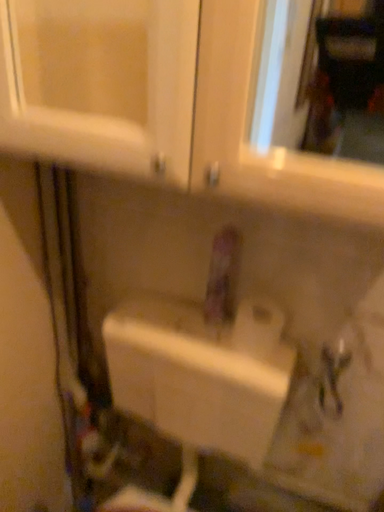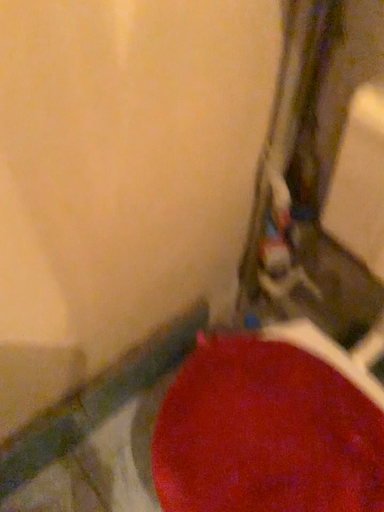
Question: Which way did the camera rotate in the video?

Choices:
 (A) rotated downward
 (B) rotated upward

Answer: (A)